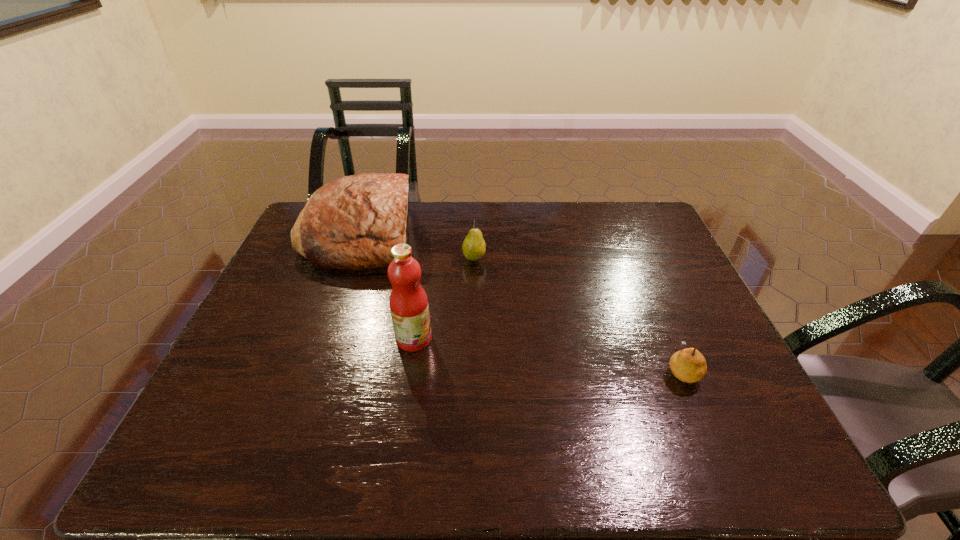
This screenshot has height=540, width=960. Find the location of `vacant space located on the front of the third tallest object`. vacant space located on the front of the third tallest object is located at coordinates (473, 308).

Identify the location of free spot located on the back of the nearer pear. (642, 278).

The image size is (960, 540). What are the coordinates of `object that is at the far edge` in the screenshot? It's located at (352, 222).

The height and width of the screenshot is (540, 960). Identify the location of object located at the left edge. (352, 222).

Where is `object that is at the right edge`? object that is at the right edge is located at coordinates (688, 365).

At what (x,y) coordinates should I click in order to perform the action: click on object situated at the far left corner. Please return your answer as a coordinate pair (x, y). Looking at the image, I should click on (352, 222).

In the image, there is a desktop. Identify the location of blank space at the far edge. (604, 237).

This screenshot has width=960, height=540. I want to click on vacant space at the near edge, so click(469, 437).

Find the location of a particular element. vacant space at the left edge of the desktop is located at coordinates point(311,303).

In the image, there is a desktop. Identify the location of vacant region at the right edge. The width and height of the screenshot is (960, 540). (631, 253).